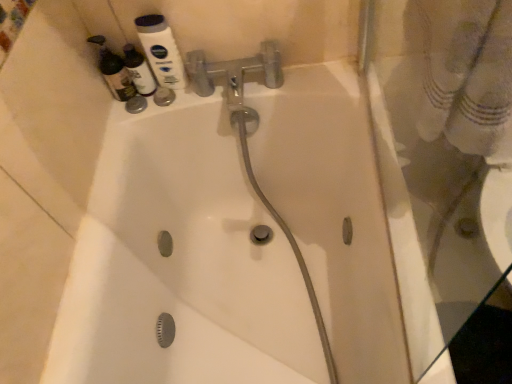
Question: Should I look upward or downward to see matte white bottle at upper left, placed as the 1th cleaning product when sorted from left to right?

Choices:
 (A) down
 (B) up

Answer: (B)

Question: Is matte white bottle at upper left, the second cleaning product when ordered from right to left, located within matte white bottle at upper left, which appears as the first cleaning product when viewed from the right?

Choices:
 (A) yes
 (B) no

Answer: (B)

Question: Considering the relative sizes of matte white bottle at upper left, arranged as the second cleaning product when viewed from the left, and matte white bottle at upper left, the second cleaning product when ordered from right to left, in the image provided, is matte white bottle at upper left, arranged as the second cleaning product when viewed from the left, wider than matte white bottle at upper left, the second cleaning product when ordered from right to left,?

Choices:
 (A) no
 (B) yes

Answer: (A)

Question: From the image's perspective, is matte white bottle at upper left, arranged as the second cleaning product when viewed from the left, located above matte white bottle at upper left, the second cleaning product when ordered from right to left?

Choices:
 (A) no
 (B) yes

Answer: (A)

Question: Considering the relative sizes of matte white bottle at upper left, which appears as the first cleaning product when viewed from the right, and matte white bottle at upper left, placed as the 1th cleaning product when sorted from left to right, in the image provided, is matte white bottle at upper left, which appears as the first cleaning product when viewed from the right, thinner than matte white bottle at upper left, placed as the 1th cleaning product when sorted from left to right,?

Choices:
 (A) no
 (B) yes

Answer: (B)

Question: From a real-world perspective, is matte white bottle at upper left, which appears as the first cleaning product when viewed from the right, on matte white bottle at upper left, placed as the 1th cleaning product when sorted from left to right?

Choices:
 (A) yes
 (B) no

Answer: (B)

Question: Does matte white bottle at upper left, arranged as the second cleaning product when viewed from the left, have a greater height compared to matte white bottle at upper left, placed as the 1th cleaning product when sorted from left to right?

Choices:
 (A) no
 (B) yes

Answer: (A)

Question: Is white glossy mouthwash at upper left turned away from matte white bottle at upper left, the second cleaning product when ordered from right to left?

Choices:
 (A) yes
 (B) no

Answer: (B)

Question: Is white glossy mouthwash at upper left bigger than matte white bottle at upper left, placed as the 1th cleaning product when sorted from left to right?

Choices:
 (A) no
 (B) yes

Answer: (A)

Question: From the image's perspective, is white glossy mouthwash at upper left located beneath matte white bottle at upper left, the second cleaning product when ordered from right to left?

Choices:
 (A) yes
 (B) no

Answer: (B)

Question: Considering the relative positions of white glossy mouthwash at upper left and matte white bottle at upper left, placed as the 1th cleaning product when sorted from left to right, in the image provided, is white glossy mouthwash at upper left to the right of matte white bottle at upper left, placed as the 1th cleaning product when sorted from left to right, from the viewer's perspective?

Choices:
 (A) no
 (B) yes

Answer: (B)

Question: Is white glossy mouthwash at upper left further to camera compared to matte white bottle at upper left, the second cleaning product when ordered from right to left?

Choices:
 (A) no
 (B) yes

Answer: (A)

Question: Is white glossy mouthwash at upper left not inside matte white bottle at upper left, placed as the 1th cleaning product when sorted from left to right?

Choices:
 (A) no
 (B) yes

Answer: (B)

Question: Is matte white bottle at upper left, placed as the 1th cleaning product when sorted from left to right, in front of matte white bottle at upper left, which appears as the first cleaning product when viewed from the right?

Choices:
 (A) no
 (B) yes

Answer: (B)